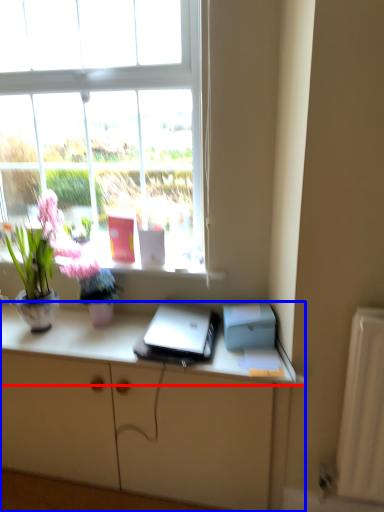
Question: Which object appears closest to the camera in this image, desk (highlighted by a red box) or cabinetry (highlighted by a blue box)?

Choices:
 (A) desk
 (B) cabinetry

Answer: (A)